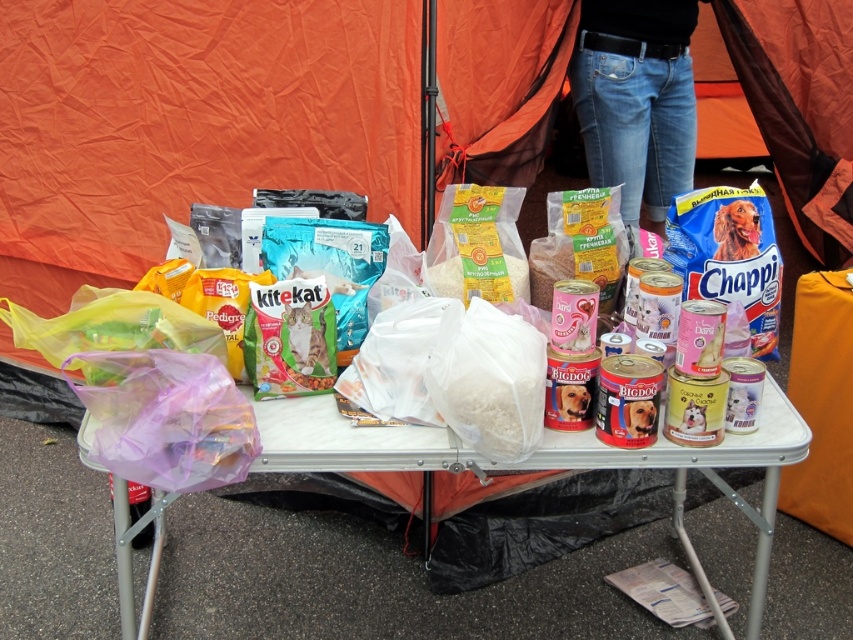
Question: Which point appears farthest from the camera in this image?

Choices:
 (A) (610, 108)
 (B) (749, 461)

Answer: (A)

Question: Does translucent plastic bag at lower left have a smaller size compared to jeans at center?

Choices:
 (A) no
 (B) yes

Answer: (A)

Question: Can you confirm if translucent plastic bag at lower left is positioned to the left of jeans at center?

Choices:
 (A) yes
 (B) no

Answer: (A)

Question: Does translucent plastic bag at lower left have a larger size compared to jeans at center?

Choices:
 (A) no
 (B) yes

Answer: (B)

Question: Which object is farther from the camera taking this photo?

Choices:
 (A) jeans at center
 (B) translucent plastic bag at lower left

Answer: (A)